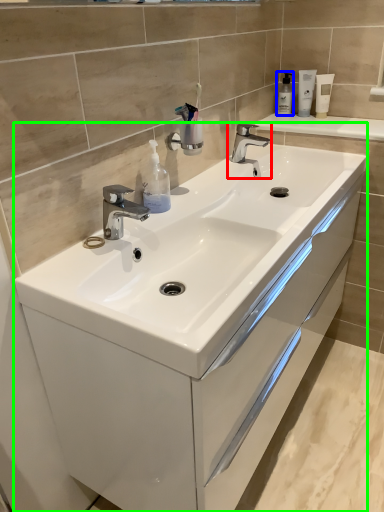
Question: Based on their relative distances, which object is nearer to tap (highlighted by a red box)? Choose from soap dispenser (highlighted by a blue box) and bathroom cabinet (highlighted by a green box).

Choices:
 (A) soap dispenser
 (B) bathroom cabinet

Answer: (A)